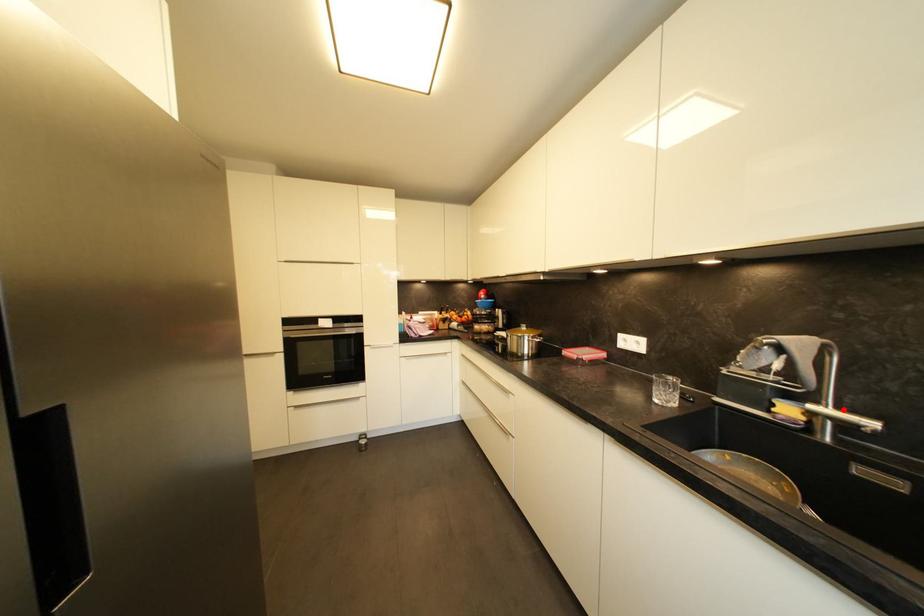
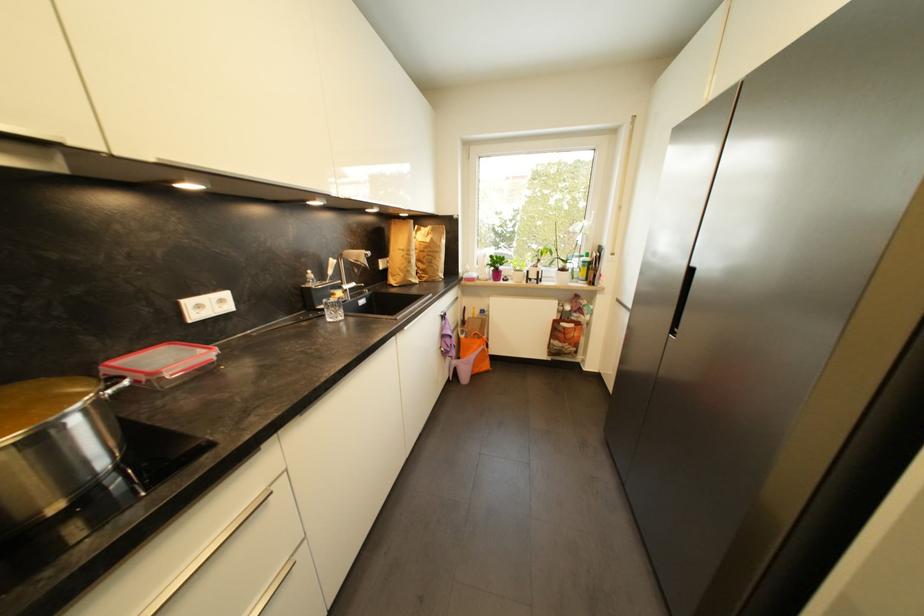
Find the pixel in the second image that matches the highlighted location in the first image.

(353, 285)